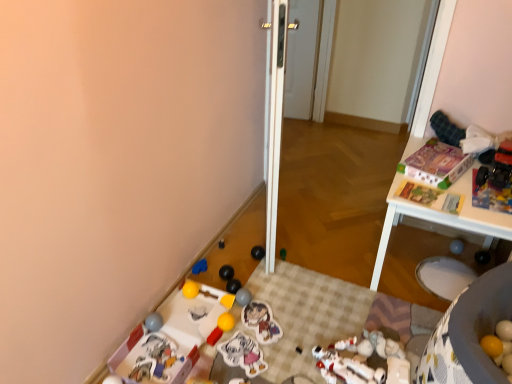
Locate an element on the screen. vacant area to the right of plastic toy car at lower left, the 2th toy positioned from the left is located at coordinates (213, 348).